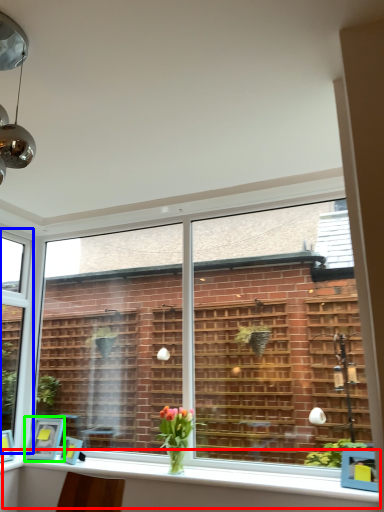
Question: Based on their relative distances, which object is farther from window sill (highlighted by a red box)? Choose from window (highlighted by a blue box) and picture frame (highlighted by a green box).

Choices:
 (A) window
 (B) picture frame

Answer: (A)